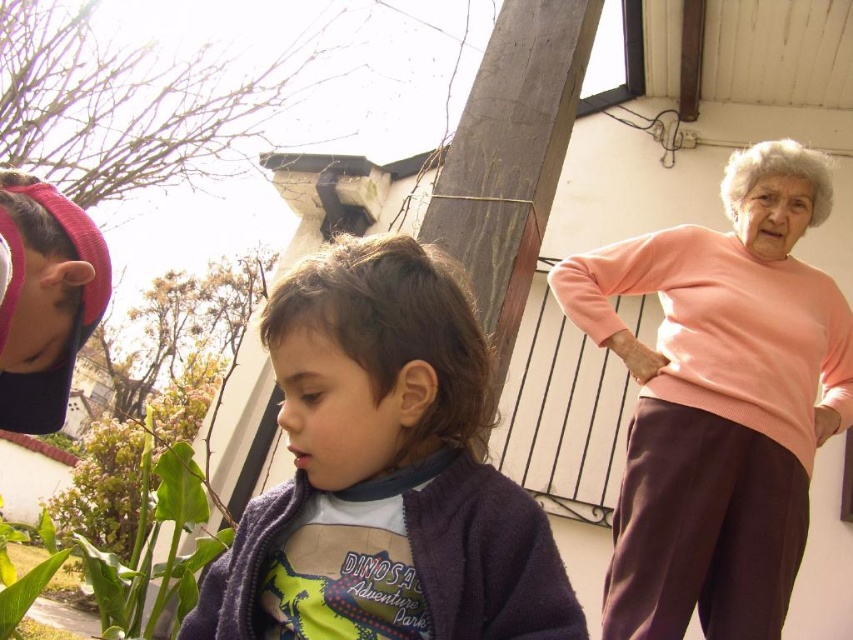
Who is positioned more to the right, purple fleece jacket at center or pink knit sweater at right?

pink knit sweater at right is more to the right.

Who is more forward, (346,324) or (715,461)?

Point (346,324) is more forward.

I want to click on purple fleece jacket at center, so click(387, 467).

Can you confirm if purple fleece jacket at center is shorter than pink fabric cap at upper left?

In fact, purple fleece jacket at center may be taller than pink fabric cap at upper left.

Who is lower down, purple fleece jacket at center or pink fabric cap at upper left?

Positioned lower is purple fleece jacket at center.

Is point (364, 337) closer to camera compared to point (20, 268)?

Yes, it is in front of point (20, 268).

This screenshot has width=853, height=640. What are the coordinates of `purple fleece jacket at center` in the screenshot? It's located at (387, 467).

Can you confirm if pink fabric cap at upper left is smaller than green leafy plant at lower left?

Yes.

Can you confirm if pink fabric cap at upper left is wider than green leafy plant at lower left?

No.

Locate an element on the screen. pink fabric cap at upper left is located at coordinates (45, 300).

At what (x,y) coordinates should I click in order to perform the action: click on pink fabric cap at upper left. Please return your answer as a coordinate pair (x, y). This screenshot has width=853, height=640. Looking at the image, I should click on (45, 300).